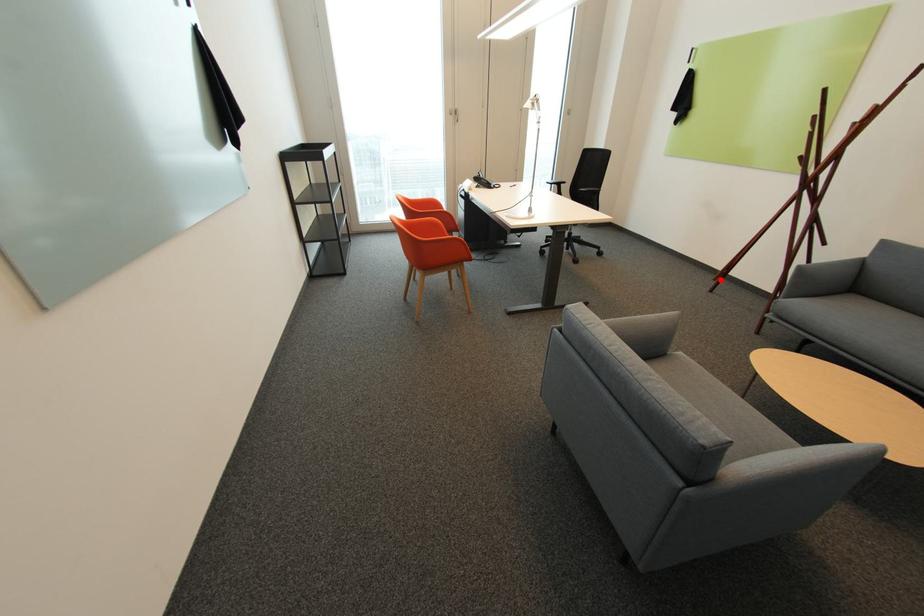
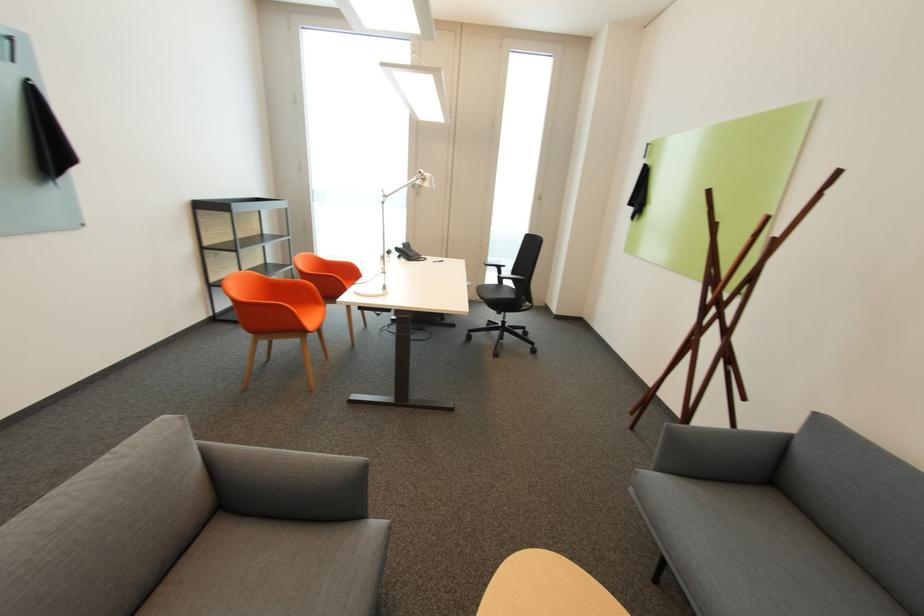
In the second image, find the point that corresponds to the highlighted location in the first image.

(638, 414)